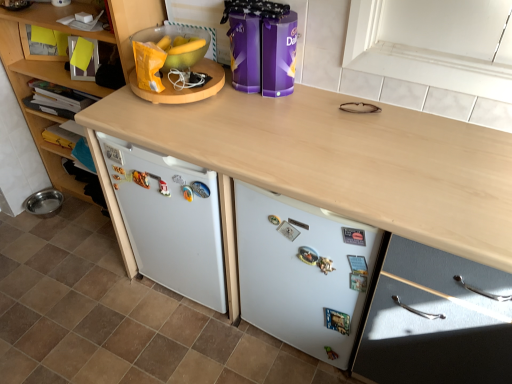
In order to click on free spot above light wood/texture drawer at lower right, which is the 1th cabinetry from right to left (from a real-world perspective) in this screenshot , I will do `click(478, 184)`.